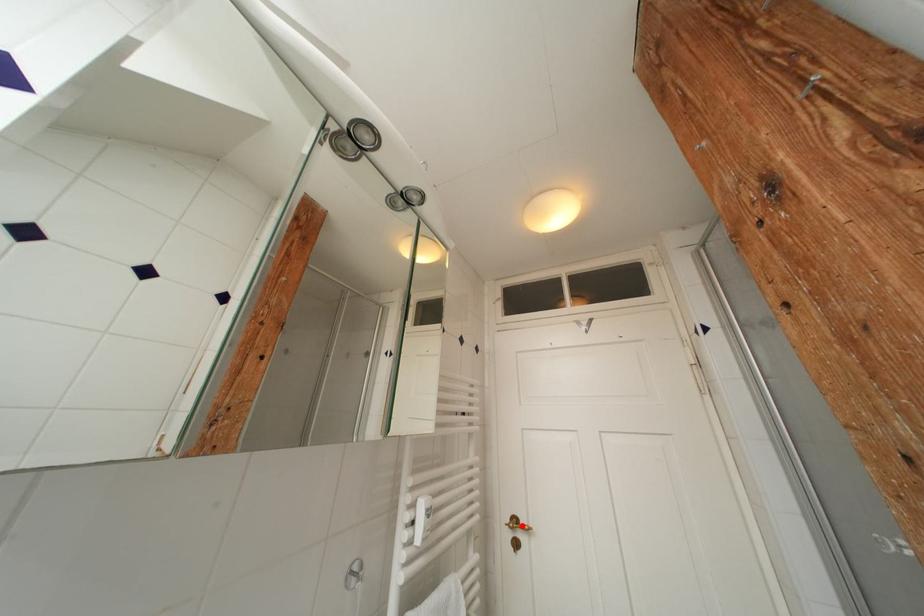
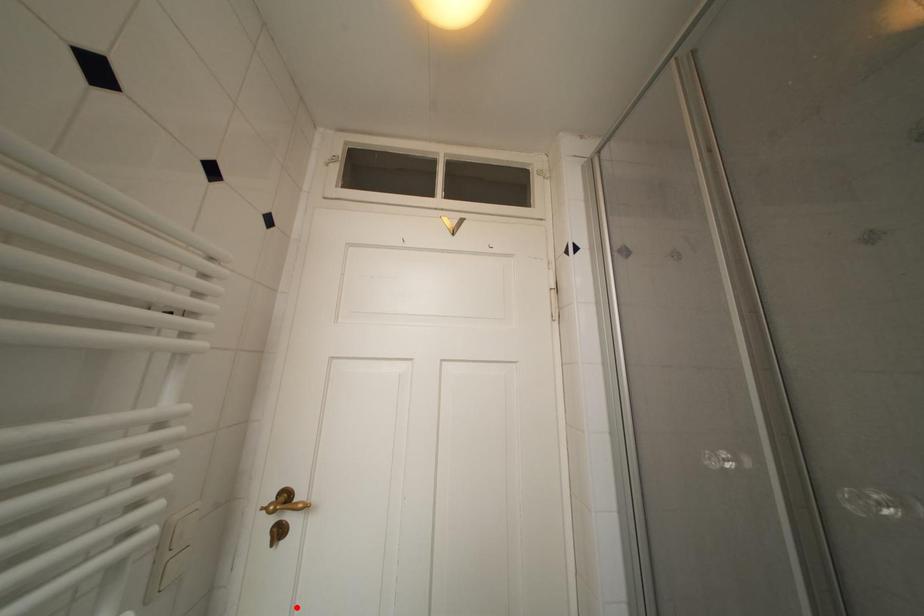
I am providing you with two images of the same scene from different viewpoints. A red point is marked on the first image and another point is marked on the second image. Is the marked point in image1 the same physical position as the marked point in image2?

No